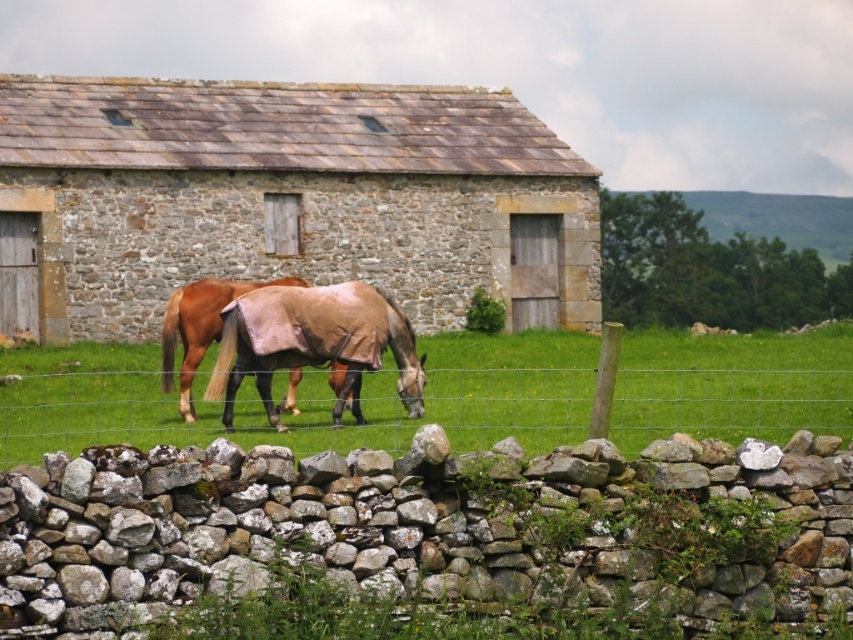
Is the position of stone textured barn at center more distant than that of brown leather horse at center?

Yes, stone textured barn at center is behind brown leather horse at center.

Does stone textured barn at center appear under brown leather horse at center?

Incorrect, stone textured barn at center is not positioned below brown leather horse at center.

I want to click on stone textured barn at center, so click(286, 196).

Who is positioned more to the right, stone textured barn at center or green grass at center?

From the viewer's perspective, green grass at center appears more on the right side.

Is stone textured barn at center taller than green grass at center?

Yes.

Identify the location of stone textured barn at center. coord(286,196).

Between point (112, 420) and point (263, 339), which one is positioned in front?

Point (263, 339) is more forward.

You are a GUI agent. You are given a task and a screenshot of the screen. Output one action in this format:
    pyautogui.click(x=<x>, y=<y>)
    Task: Click on the green grass at center
    The width and height of the screenshot is (853, 640).
    Given the screenshot: What is the action you would take?
    pyautogui.click(x=732, y=385)